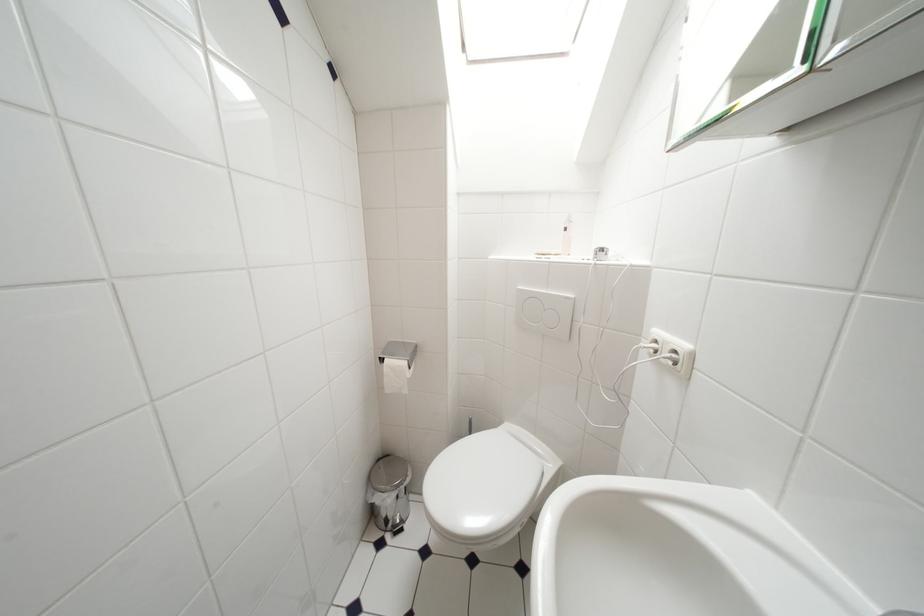
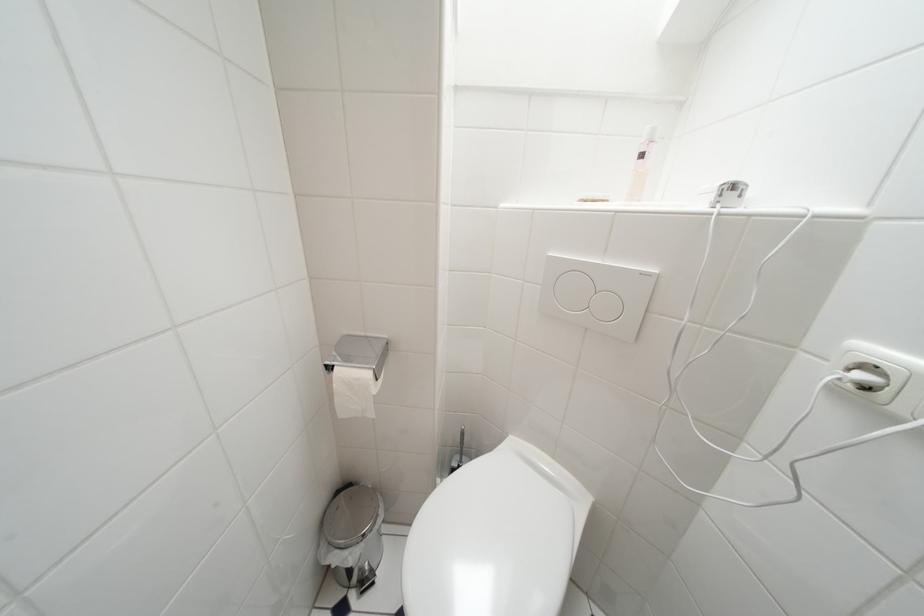
Question: The first image is from the beginning of the video and the second image is from the end. How did the camera likely rotate when shooting the video?

Choices:
 (A) Left
 (B) Right
 (C) Up
 (D) Down

Answer: (D)